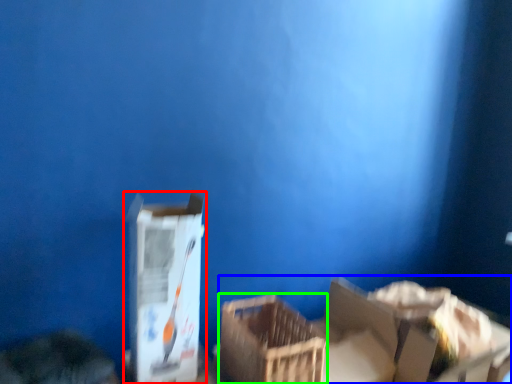
Question: Which object is the farthest from box (highlighted by a red box)? Choose among these: storage box (highlighted by a blue box) or crate (highlighted by a green box).

Choices:
 (A) storage box
 (B) crate

Answer: (A)